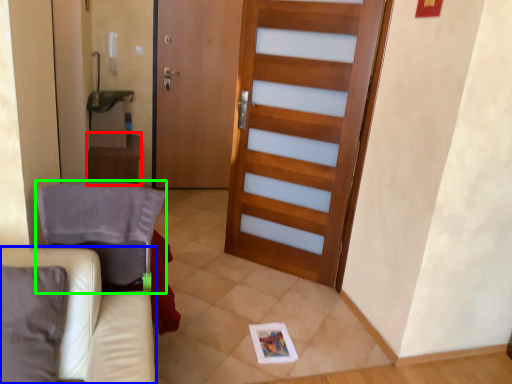
Question: Estimate the real-world distances between objects in this image. Which object is farther from table (highlighted by a red box), furniture (highlighted by a blue box) or armchair (highlighted by a green box)?

Choices:
 (A) furniture
 (B) armchair

Answer: (A)